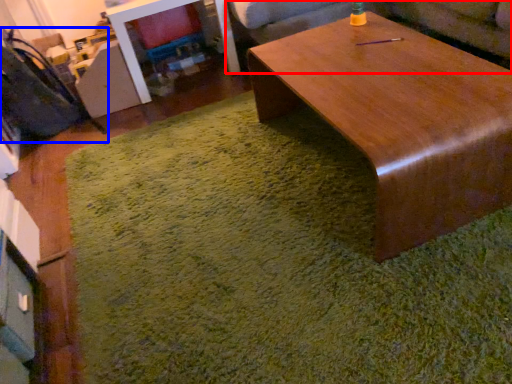
Question: Among these objects, which one is farthest to the camera, couch (highlighted by a red box) or swivel chair (highlighted by a blue box)?

Choices:
 (A) couch
 (B) swivel chair

Answer: (A)